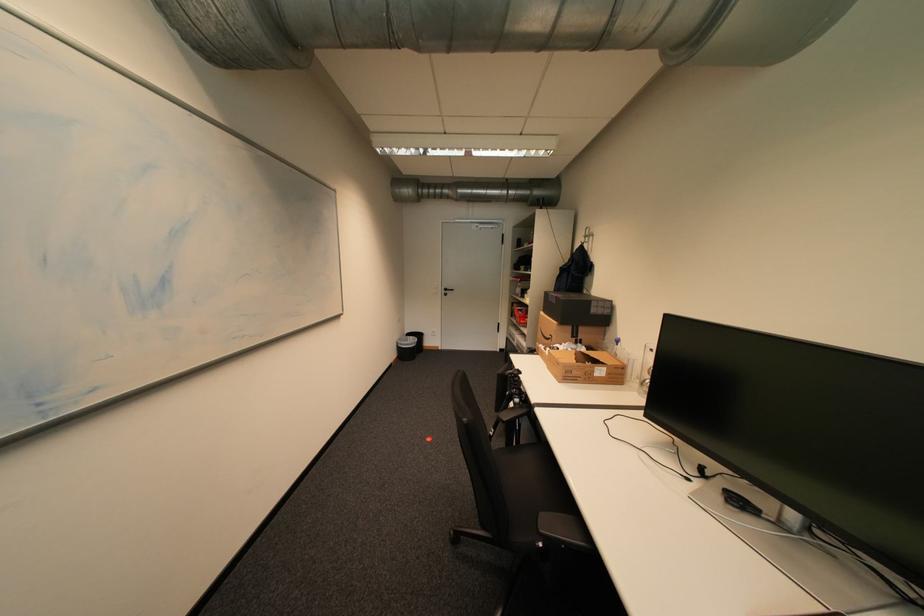
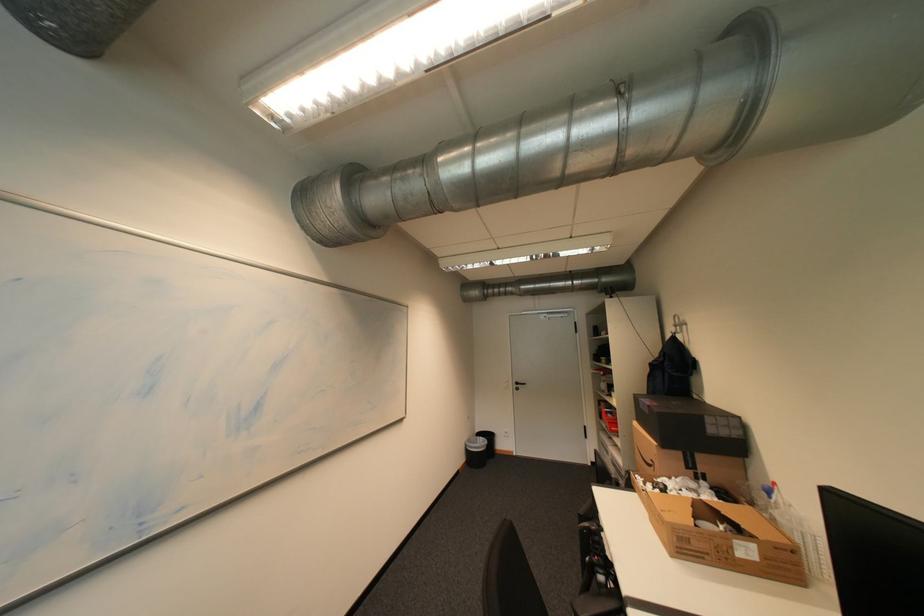
How did the camera likely rotate?

The rotation direction of the camera is left-up.